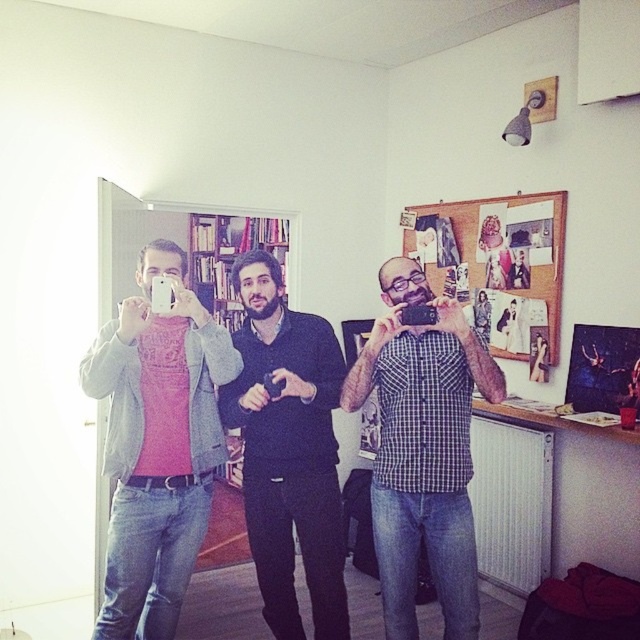
Is pink matte shirt at center positioned behind checkered fabric shirt at center?

No, pink matte shirt at center is in front of checkered fabric shirt at center.

Who is shorter, pink matte shirt at center or checkered fabric shirt at center?

checkered fabric shirt at center

Consider the image. Measure the distance between pink matte shirt at center and camera.

pink matte shirt at center is 2.22 meters away from camera.

At what (x,y) coordinates should I click in order to perform the action: click on pink matte shirt at center. Please return your answer as a coordinate pair (x, y). Looking at the image, I should click on [157, 444].

Does checkered fabric shirt at center have a greater height compared to dark blue sweater at center?

No, checkered fabric shirt at center is not taller than dark blue sweater at center.

Is checkered fabric shirt at center wider than dark blue sweater at center?

Correct, the width of checkered fabric shirt at center exceeds that of dark blue sweater at center.

Is point (372, 474) closer to camera compared to point (298, 637)?

Yes, point (372, 474) is in front of point (298, 637).

You are a GUI agent. You are given a task and a screenshot of the screen. Output one action in this format:
    pyautogui.click(x=<x>, y=<y>)
    Task: Click on the checkered fabric shirt at center
    The height and width of the screenshot is (640, 640).
    Given the screenshot: What is the action you would take?
    pyautogui.click(x=422, y=449)

Does pink matte shirt at center appear under dark blue sweater at center?

Actually, pink matte shirt at center is above dark blue sweater at center.

Which is in front, point (124, 620) or point (321, 477)?

Point (124, 620)

Who is more distant from viewer, (184, 272) or (332, 602)?

Point (332, 602)

The height and width of the screenshot is (640, 640). What are the coordinates of `pink matte shirt at center` in the screenshot? It's located at (157, 444).